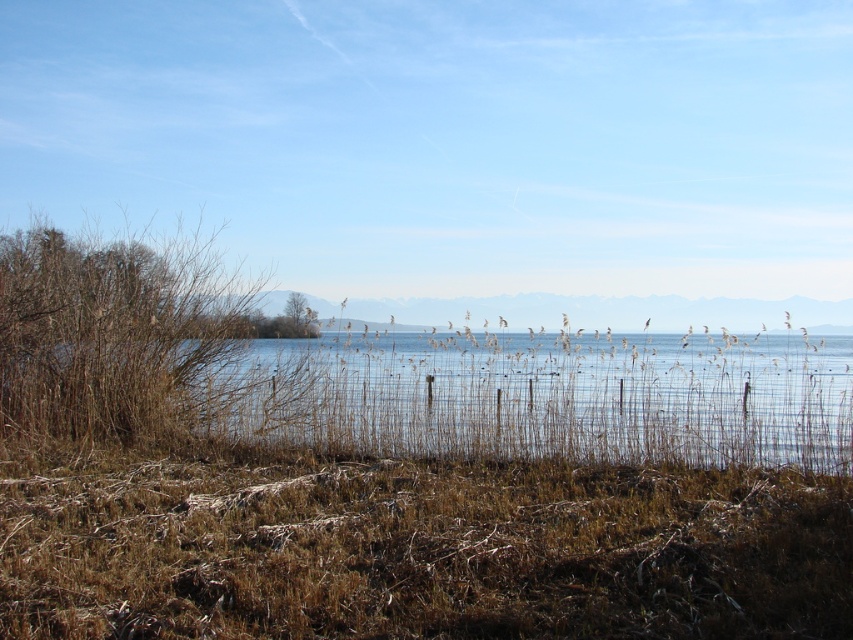
You are a hiker who wants to cross the lake using the reeds as a path. You notice two patches of brown dry grass at lower center and brown dry grass at left. Which patch of grass is taller and might provide a sturdier path?

The brown dry grass at lower center is taller than the brown dry grass at left, so it might provide a sturdier path.